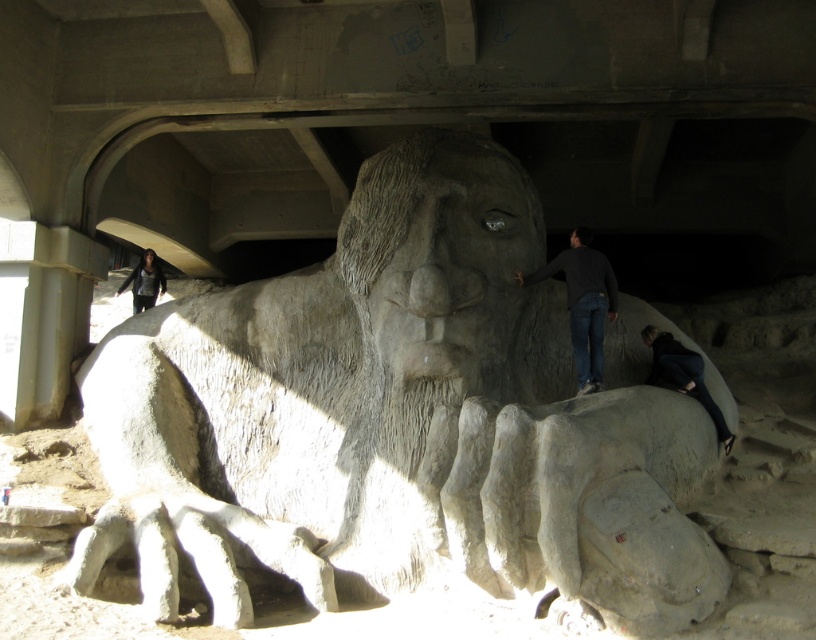
You are standing in front of the stone sculpture and want to know how far the point at coordinates (645,556) is from you. Can you determine the distance?

The point at coordinates (645,556) is 10.85 meters away from the viewer.

In the scene shown: You are standing at the base of the sculpture and want to take a photo of the gray stone statue at center without the dark gray sweater at lower left appearing in the frame. How should you adjust your position?

Move closer to the gray stone statue at center so that it blocks the view of the dark gray sweater at lower left, as the gray stone statue at center is in front of the dark gray sweater at lower left.